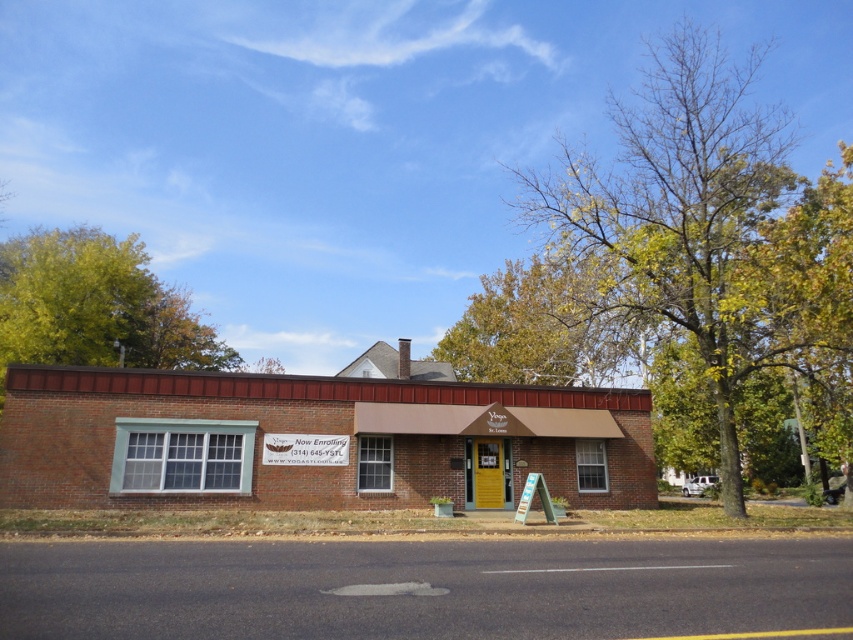
Is green leafy tree at center in front of yellow-green leaves at upper center?

That is False.

Image resolution: width=853 pixels, height=640 pixels. Describe the element at coordinates (682, 208) in the screenshot. I see `green leafy tree at center` at that location.

Is point (683, 28) positioned after point (569, 346)?

Yes, it is behind point (569, 346).

The width and height of the screenshot is (853, 640). I want to click on green leafy tree at center, so click(682, 208).

Is point (125, 502) positioned before point (543, 316)?

That is True.

Does brick building at center appear over yellow-green leaves at upper center?

No, brick building at center is not above yellow-green leaves at upper center.

At what (x,y) coordinates should I click in order to perform the action: click on brick building at center. Please return your answer as a coordinate pair (x, y). The image size is (853, 640). Looking at the image, I should click on (312, 440).

Identify the location of brick building at center. This screenshot has width=853, height=640. (312, 440).

Identify the location of green leafy tree at upper left. Image resolution: width=853 pixels, height=640 pixels. (96, 307).

Does green leafy tree at upper left appear over yellow-green leaves at upper center?

Correct, green leafy tree at upper left is located above yellow-green leaves at upper center.

Identify the location of green leafy tree at upper left. The width and height of the screenshot is (853, 640). (96, 307).

Find the location of a particular element. The height and width of the screenshot is (640, 853). green leafy tree at upper left is located at coordinates [96, 307].